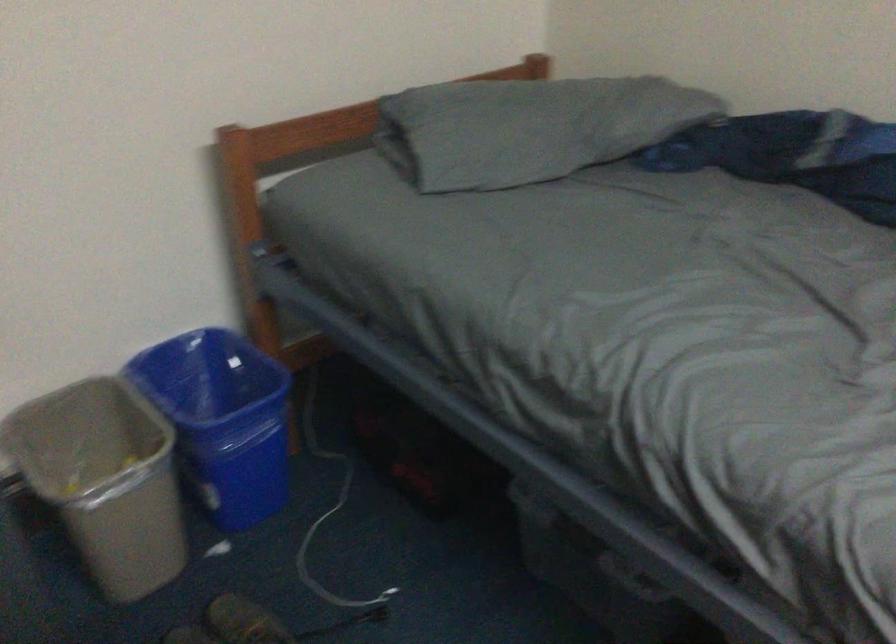
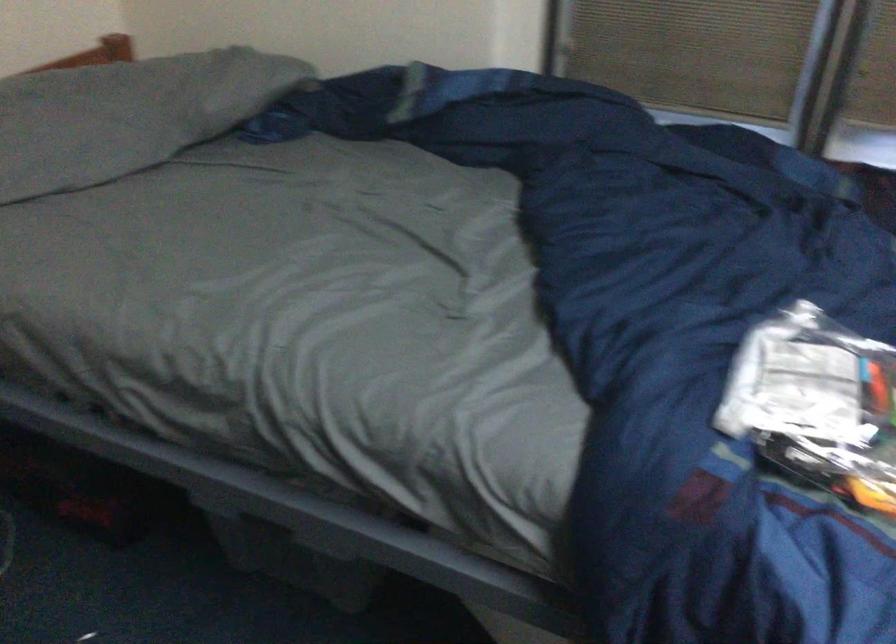
Question: The camera is either moving clockwise (left) or counter-clockwise (right) around the object. The first image is from the beginning of the video and the second image is from the end. Is the camera moving left or right when shooting the video?

Choices:
 (A) Left
 (B) Right

Answer: (A)